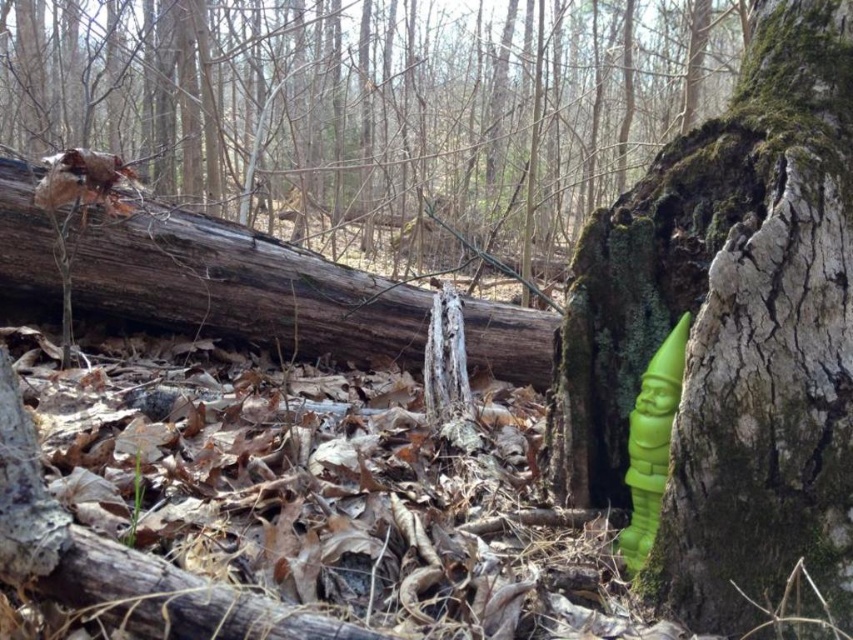
Does green plastic gnome at right appear on the left side of green matte gnome at center?

Indeed, green plastic gnome at right is positioned on the left side of green matte gnome at center.

The width and height of the screenshot is (853, 640). I want to click on green plastic gnome at right, so 374,113.

This screenshot has height=640, width=853. Describe the element at coordinates (374, 113) in the screenshot. I see `green plastic gnome at right` at that location.

Locate an element on the screen. Image resolution: width=853 pixels, height=640 pixels. green plastic gnome at right is located at coordinates (374, 113).

Can you confirm if green plastic gnome at right is positioned to the right of green matte gnome at right?

No, green plastic gnome at right is not to the right of green matte gnome at right.

Is point (143, 122) closer to camera compared to point (659, 476)?

No, (143, 122) is behind (659, 476).

Locate an element on the screen. This screenshot has height=640, width=853. green plastic gnome at right is located at coordinates (374, 113).

Does green matte gnome at center appear under green matte gnome at right?

Actually, green matte gnome at center is above green matte gnome at right.

Can you confirm if green matte gnome at center is thinner than green matte gnome at right?

In fact, green matte gnome at center might be wider than green matte gnome at right.

This screenshot has width=853, height=640. I want to click on green matte gnome at center, so click(730, 333).

Where is `green matte gnome at center`? Image resolution: width=853 pixels, height=640 pixels. green matte gnome at center is located at coordinates point(730,333).